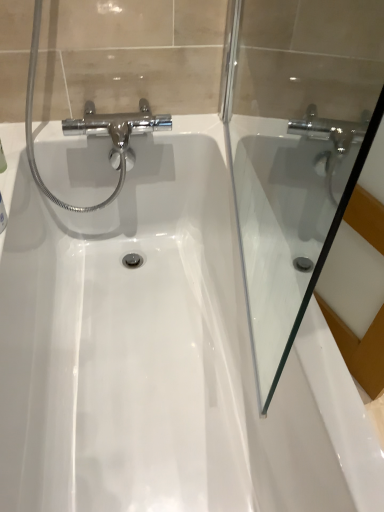
This screenshot has height=512, width=384. I want to click on transparent glass shower door at center, so click(294, 151).

The width and height of the screenshot is (384, 512). Describe the element at coordinates (294, 151) in the screenshot. I see `transparent glass shower door at center` at that location.

Measure the distance between transparent glass shower door at center and camera.

transparent glass shower door at center and camera are 75.89 centimeters apart.

In order to face transparent glass shower door at center, should I rotate leftwards or rightwards?

It's best to rotate right around 7.739 degrees.

Identify the location of transparent glass shower door at center. The width and height of the screenshot is (384, 512). (294, 151).